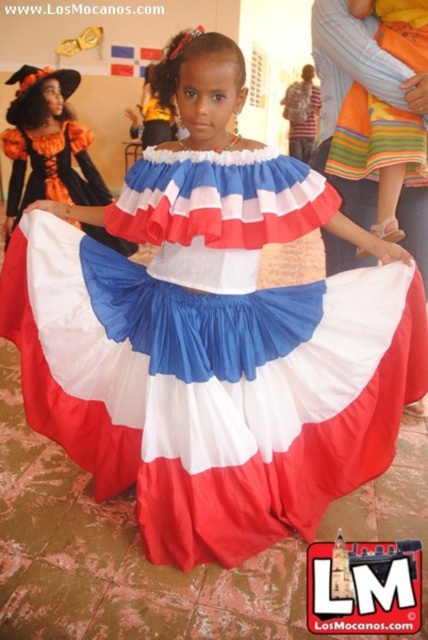
Is point (404, 61) positioned in front of point (94, 232)?

That is True.

Does striped cotton dress at center have a greater height compared to matte fabric dress at center?

In fact, striped cotton dress at center may be shorter than matte fabric dress at center.

Find the location of a particular element. This screenshot has width=428, height=640. striped cotton dress at center is located at coordinates (377, 140).